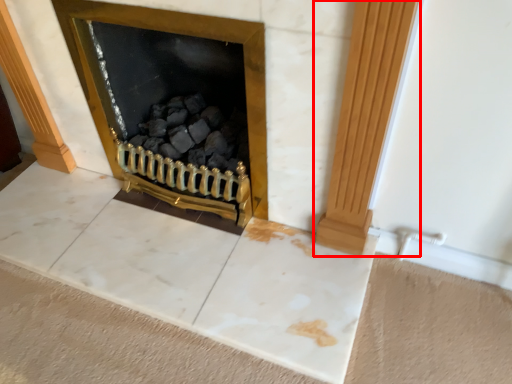
Question: From the image's perspective, considering the relative positions of pillar (annotated by the red box) and fireplace in the image provided, where is pillar (annotated by the red box) located with respect to the staircase?

Choices:
 (A) above
 (B) below

Answer: (B)